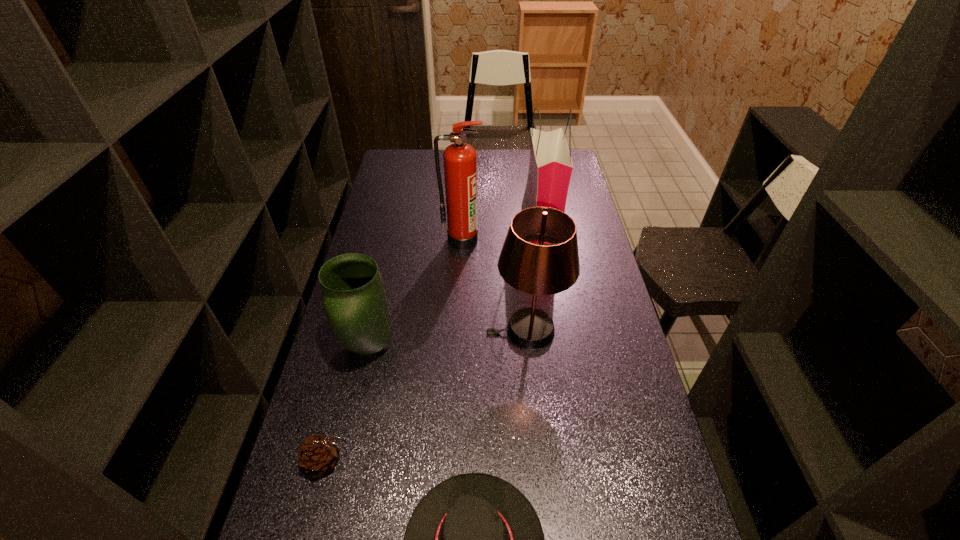
This screenshot has width=960, height=540. Identify the location of vacant space in between the shopping bag and the pinecone. (x=434, y=344).

Locate an element on the screen. The height and width of the screenshot is (540, 960). empty space that is in between the fire extinguisher and the shopping bag is located at coordinates tap(501, 233).

Locate an element on the screen. vacant space that's between the pinecone and the fire extinguisher is located at coordinates (394, 350).

At what (x,y) coordinates should I click in order to perform the action: click on vacant space in between the vase and the pinecone. Please return your answer as a coordinate pair (x, y). Looking at the image, I should click on (348, 404).

Locate an element on the screen. The height and width of the screenshot is (540, 960). blank region between the shopping bag and the pinecone is located at coordinates (434, 344).

Where is `unoccupied area between the lampshade and the pinecone`? The height and width of the screenshot is (540, 960). unoccupied area between the lampshade and the pinecone is located at coordinates (426, 396).

Image resolution: width=960 pixels, height=540 pixels. I want to click on object that is the fourth closest one to the shopping bag, so click(x=474, y=539).

Locate which object is the fourth closest to the fire extinguisher. Please provide its 2D coordinates. Your answer should be formatted as a tuple, i.e. [(x, y)], where the tuple contains the x and y coordinates of a point satisfying the conditions above.

[(318, 455)]

Identify the location of free spot that satisfies the following two spatial constraints: 1. on the front-facing side of the shopping bag; 2. with the nozzle pointing from the back of the fire extinguisher. This screenshot has width=960, height=540. (543, 240).

Where is `free space that satisfies the following two spatial constraints: 1. on the front-facing side of the shopping bag; 2. with the nozzle pointing from the back of the fire extinguisher`? Image resolution: width=960 pixels, height=540 pixels. free space that satisfies the following two spatial constraints: 1. on the front-facing side of the shopping bag; 2. with the nozzle pointing from the back of the fire extinguisher is located at coordinates (543, 240).